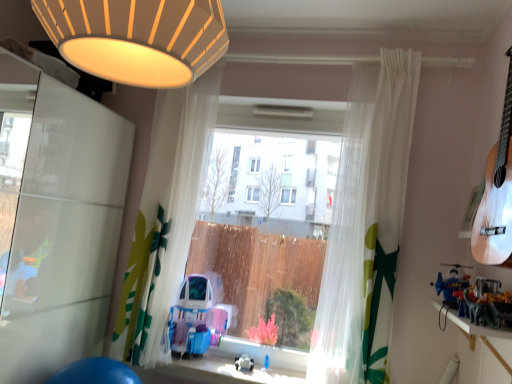
Question: Should I look upward or downward to see wooden shelf at lower right?

Choices:
 (A) down
 (B) up

Answer: (A)

Question: Can you confirm if white glossy screen door at left is positioned to the left of transparent plastic window at center?

Choices:
 (A) no
 (B) yes

Answer: (B)

Question: Can you confirm if white glossy screen door at left is smaller than transparent plastic window at center?

Choices:
 (A) yes
 (B) no

Answer: (B)

Question: Is white glossy screen door at left taller than transparent plastic window at center?

Choices:
 (A) no
 (B) yes

Answer: (B)

Question: Is white glossy screen door at left oriented away from transparent plastic window at center?

Choices:
 (A) no
 (B) yes

Answer: (A)

Question: Is white glossy screen door at left far from transparent plastic window at center?

Choices:
 (A) yes
 (B) no

Answer: (B)

Question: Is the depth of white glossy screen door at left greater than that of transparent plastic window at center?

Choices:
 (A) yes
 (B) no

Answer: (B)

Question: From the image's perspective, is metallic silver dinosaur at right, arranged as the 1th toy when viewed from the front, beneath transparent plastic window at center?

Choices:
 (A) yes
 (B) no

Answer: (A)

Question: From a real-world perspective, does metallic silver dinosaur at right, placed as the third toy when sorted from bottom to top, stand above transparent plastic window at center?

Choices:
 (A) no
 (B) yes

Answer: (A)

Question: Considering the relative sizes of metallic silver dinosaur at right, which appears as the 2th toy when viewed from the left, and transparent plastic window at center in the image provided, is metallic silver dinosaur at right, which appears as the 2th toy when viewed from the left, smaller than transparent plastic window at center?

Choices:
 (A) yes
 (B) no

Answer: (A)

Question: Is metallic silver dinosaur at right, positioned as the first toy in top-to-bottom order, wider than transparent plastic window at center?

Choices:
 (A) no
 (B) yes

Answer: (B)

Question: Is metallic silver dinosaur at right, placed as the third toy when sorted from bottom to top, surrounding transparent plastic window at center?

Choices:
 (A) yes
 (B) no

Answer: (B)

Question: Considering the relative positions of metallic silver dinosaur at right, which is the 3th toy in back-to-front order, and transparent plastic window at center in the image provided, is metallic silver dinosaur at right, which is the 3th toy in back-to-front order, to the left of transparent plastic window at center from the viewer's perspective?

Choices:
 (A) yes
 (B) no

Answer: (B)

Question: Is metallic silver dinosaur at right, positioned as the first toy in top-to-bottom order, far from wooden shelf at lower right?

Choices:
 (A) yes
 (B) no

Answer: (B)